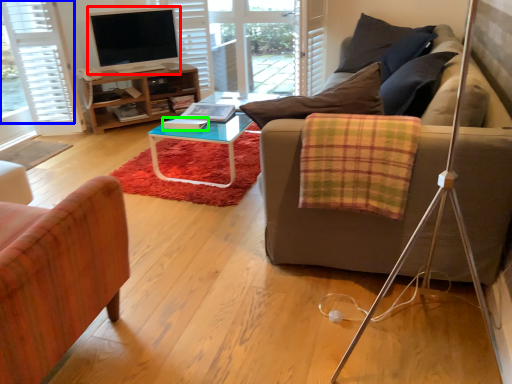
Question: Based on their relative distances, which object is farther from television (highlighted by a red box)? Choose from curtain (highlighted by a blue box) and book (highlighted by a green box).

Choices:
 (A) curtain
 (B) book

Answer: (B)